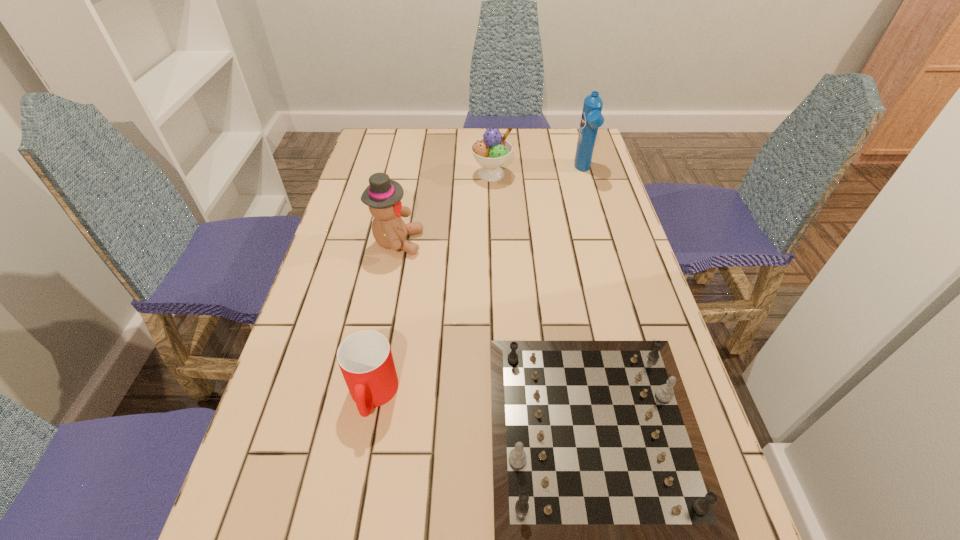
Find the location of a particular element. This screenshot has height=540, width=960. icecream present at the far edge is located at coordinates (492, 151).

You are a GUI agent. You are given a task and a screenshot of the screen. Output one action in this format:
    pyautogui.click(x=<x>, y=<y>)
    Task: Click on the rag_doll positioned at the left edge
    This screenshot has width=960, height=540.
    Given the screenshot: What is the action you would take?
    pyautogui.click(x=383, y=196)

You are a GUI agent. You are given a task and a screenshot of the screen. Output one action in this format:
    pyautogui.click(x=<x>, y=<y>)
    Task: Click on the cup that is at the left edge
    This screenshot has width=960, height=540.
    Given the screenshot: What is the action you would take?
    pyautogui.click(x=365, y=358)

Locate an element on the screen. object that is positioned at the right edge is located at coordinates (592, 118).

Identify the location of object located in the far right corner section of the desktop. (592, 118).

Find the location of a particular element. The image size is (960, 540). vacant area at the far edge is located at coordinates (441, 156).

Find the location of `vacant space at the left edge of the desktop`. vacant space at the left edge of the desktop is located at coordinates (300, 329).

Image resolution: width=960 pixels, height=540 pixels. In the image, there is a desktop. What are the coordinates of `vacant area at the right edge` in the screenshot? It's located at (574, 203).

The width and height of the screenshot is (960, 540). In the image, there is a desktop. In order to click on free space at the far left corner in this screenshot , I will do `click(393, 143)`.

Locate an element on the screen. The width and height of the screenshot is (960, 540). free area in between the shampoo and the icecream is located at coordinates (x=538, y=172).